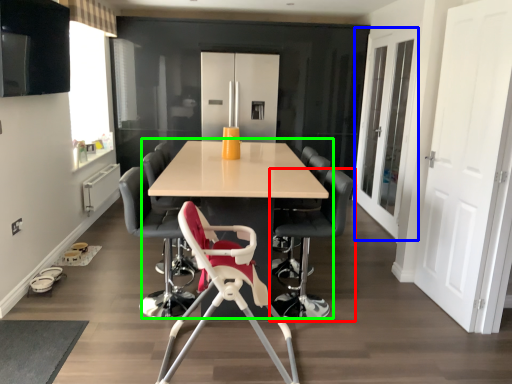
Question: Considering the real-world distances, which object is closest to chair (highlighted by a red box)? glass door (highlighted by a blue box) or table (highlighted by a green box).

Choices:
 (A) glass door
 (B) table

Answer: (B)